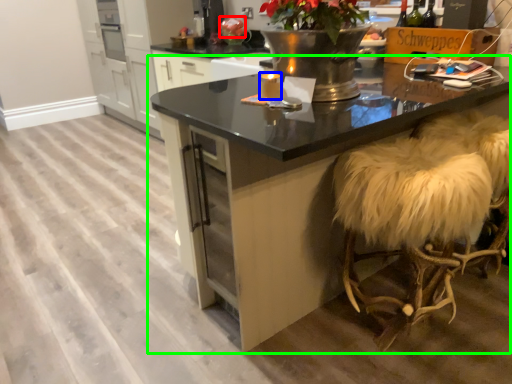
Question: Estimate the real-world distances between objects in this image. Which object is farther from flower (highlighted by a red box), candle (highlighted by a blue box) or table (highlighted by a green box)?

Choices:
 (A) candle
 (B) table

Answer: (B)